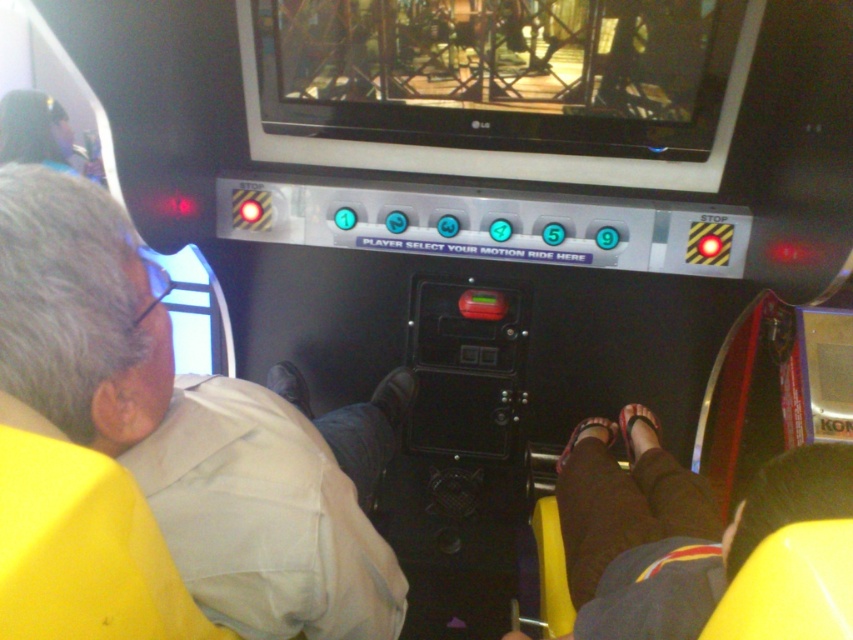
Question: Which point is farther to the camera?

Choices:
 (A) beige fabric shirt at left
 (B) matte pink sandal at lower center
 (C) brown fabric sandal at center

Answer: (C)

Question: Which point is closer to the camera taking this photo?

Choices:
 (A) (556, 465)
 (B) (323, 573)

Answer: (B)

Question: Which object is the closest to the beige fabric shirt at left?

Choices:
 (A) matte pink sandal at lower center
 (B) brown fabric sandal at center

Answer: (A)

Question: Is beige fabric shirt at left closer to the viewer compared to brown fabric sandal at center?

Choices:
 (A) yes
 (B) no

Answer: (A)

Question: Does beige fabric shirt at left appear under brown fabric sandal at center?

Choices:
 (A) no
 (B) yes

Answer: (A)

Question: In this image, where is matte pink sandal at lower center located relative to brown fabric sandal at center?

Choices:
 (A) right
 (B) left

Answer: (A)